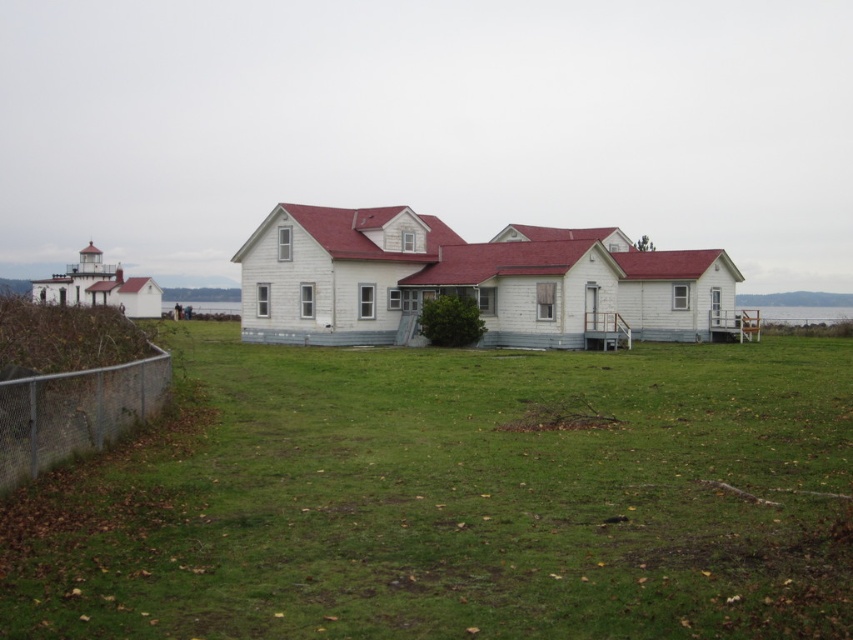
From the picture: Between green grass at center and metal chain-link fence at lower left, which one is positioned lower?

green grass at center

Can you confirm if green grass at center is positioned to the right of metal chain-link fence at lower left?

Correct, you'll find green grass at center to the right of metal chain-link fence at lower left.

Describe the element at coordinates (454, 499) in the screenshot. I see `green grass at center` at that location.

This screenshot has width=853, height=640. I want to click on green grass at center, so click(x=454, y=499).